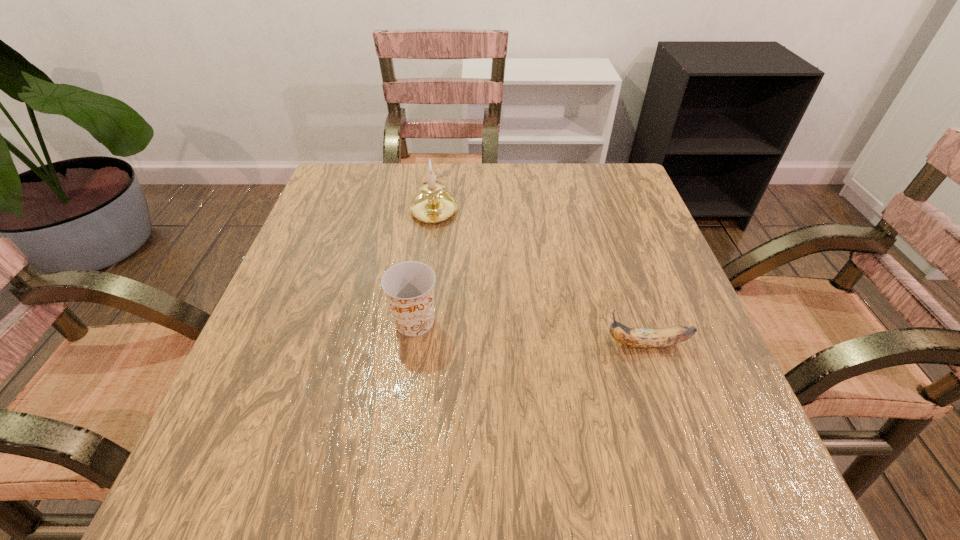
Find the location of `vacant space located on the peel of the shortest object`. vacant space located on the peel of the shortest object is located at coordinates (529, 345).

Where is `object that is at the far edge`? The height and width of the screenshot is (540, 960). object that is at the far edge is located at coordinates pyautogui.click(x=433, y=204).

I want to click on object present at the right edge, so click(x=638, y=338).

You are a GUI agent. You are given a task and a screenshot of the screen. Output one action in this format:
    pyautogui.click(x=<x>, y=<y>)
    Task: Click on the vacant area at the far edge
    This screenshot has width=960, height=540.
    Given the screenshot: What is the action you would take?
    [x=554, y=197]

You are a GUI agent. You are given a task and a screenshot of the screen. Output one action in this format:
    pyautogui.click(x=<x>, y=<y>)
    Task: Click on the free space at the left edge of the desktop
    
    Given the screenshot: What is the action you would take?
    pyautogui.click(x=332, y=363)

Find the location of `free spot at the right edge of the desktop`. free spot at the right edge of the desktop is located at coordinates (639, 262).

In the image, there is a desktop. Find the location of `free space at the far left corner`. free space at the far left corner is located at coordinates (378, 184).

The width and height of the screenshot is (960, 540). What are the coordinates of `vacant space at the far right corner of the desktop` in the screenshot? It's located at (610, 197).

In the image, there is a desktop. At what (x,y) coordinates should I click in order to perform the action: click on vacant space at the near right corner. Please return your answer as a coordinate pair (x, y). This screenshot has height=540, width=960. Looking at the image, I should click on (721, 481).

This screenshot has width=960, height=540. I want to click on vacant region between the candle holder and the rightmost object, so click(540, 276).